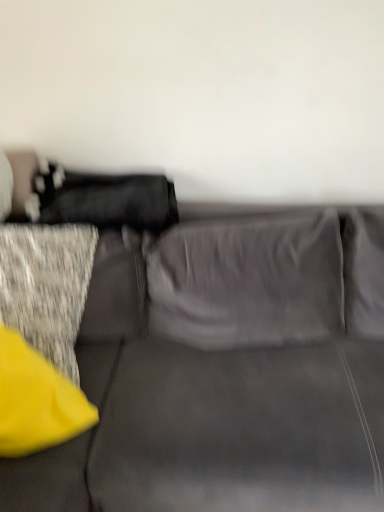
Question: From the image's perspective, is suede gray couch at center above or below yellow fabric pillow at lower left?

Choices:
 (A) above
 (B) below

Answer: (A)

Question: Considering the positions of suede gray couch at center and yellow fabric pillow at lower left in the image, is suede gray couch at center taller or shorter than yellow fabric pillow at lower left?

Choices:
 (A) short
 (B) tall

Answer: (B)

Question: In the image, is suede gray couch at center on the left side or the right side of yellow fabric pillow at lower left?

Choices:
 (A) right
 (B) left

Answer: (A)

Question: Considering the positions of point (34, 398) and point (155, 404), is point (34, 398) closer or farther from the camera than point (155, 404)?

Choices:
 (A) farther
 (B) closer

Answer: (B)

Question: Is yellow fabric pillow at lower left bigger or smaller than suede gray couch at center?

Choices:
 (A) big
 (B) small

Answer: (B)

Question: Is yellow fabric pillow at lower left to the left or to the right of suede gray couch at center in the image?

Choices:
 (A) left
 (B) right

Answer: (A)

Question: From the image's perspective, relative to suede gray couch at center, is yellow fabric pillow at lower left above or below?

Choices:
 (A) below
 (B) above

Answer: (A)